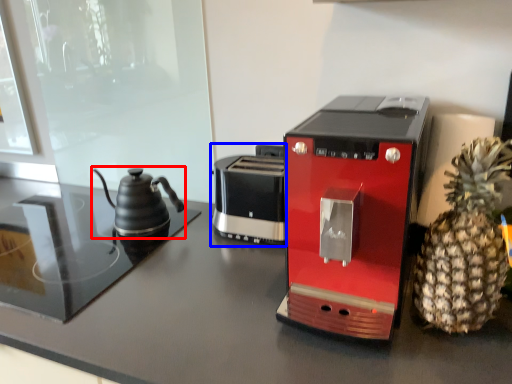
Question: Among these objects, which one is nearest to the camera, kettle (highlighted by a red box) or toaster (highlighted by a blue box)?

Choices:
 (A) kettle
 (B) toaster

Answer: (B)